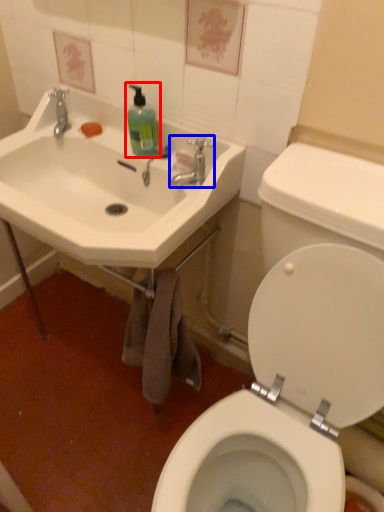
Question: Among these objects, which one is farthest to the camera, cleaning product (highlighted by a red box) or tap (highlighted by a blue box)?

Choices:
 (A) cleaning product
 (B) tap

Answer: (A)